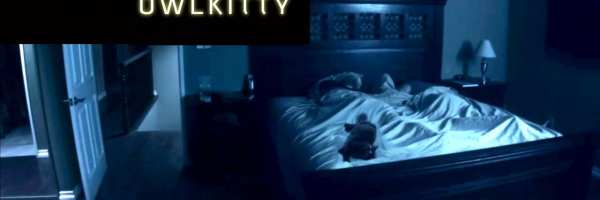
The image size is (600, 200). I want to click on bedside table, so click(496, 94), click(242, 115).